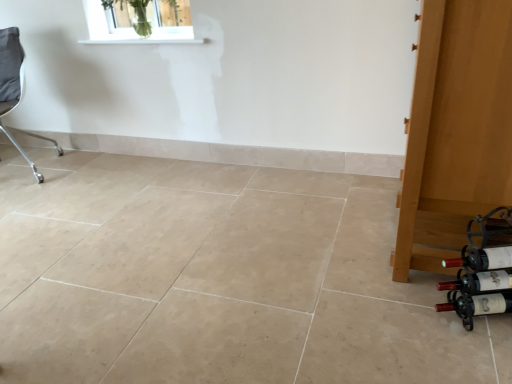
Question: Considering the positions of matte glass wine bottle at lower right, the 3th wine bottle from the bottom, and white smooth window sill at upper center in the image, is matte glass wine bottle at lower right, the 3th wine bottle from the bottom, bigger or smaller than white smooth window sill at upper center?

Choices:
 (A) small
 (B) big

Answer: (B)

Question: Is matte glass wine bottle at lower right, which is the second wine bottle in top-to-bottom order, spatially inside white smooth window sill at upper center, or outside of it?

Choices:
 (A) inside
 (B) outside

Answer: (B)

Question: Which of these objects is positioned closest to the wooden door at right?

Choices:
 (A) clear glass vase at upper center
 (B) matte glass wine bottle at lower right, which is the second wine bottle in top-to-bottom order
 (C) gray fabric chair at left
 (D) white smooth window sill at upper center
 (E) matte black wine bottle at lower right, which is the first wine bottle from top to bottom

Answer: (B)

Question: Estimate the real-world distances between objects in this image. Which object is closer to the matte glass wine bottle at lower right, which is counted as the first wine bottle, starting from the bottom?

Choices:
 (A) clear glass vase at upper center
 (B) matte glass wine bottle at lower right, the 3th wine bottle from the bottom
 (C) gray fabric chair at left
 (D) matte black wine bottle at lower right, which is the first wine bottle from top to bottom
 (E) white smooth window sill at upper center

Answer: (B)